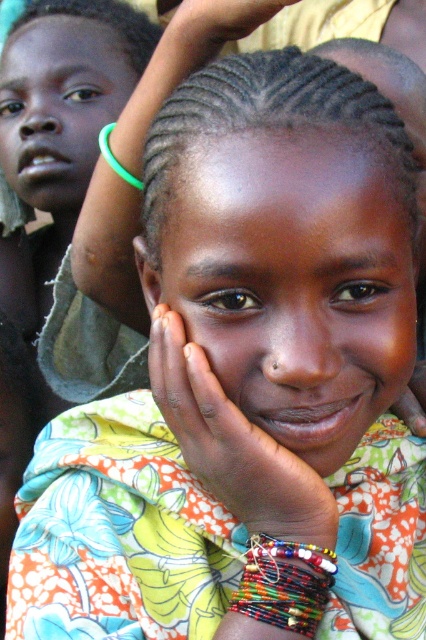
Question: Can you confirm if matte floral dress at center is bigger than green rubber bracelet at center?

Choices:
 (A) yes
 (B) no

Answer: (A)

Question: Which of these objects is positioned farthest from the matte floral dress at center?

Choices:
 (A) matte skin face at upper left
 (B) green rubber bracelet at center

Answer: (A)

Question: Which of the following is the closest to the observer?

Choices:
 (A) beaded multicolored bracelet at lower center
 (B) matte skin face at upper left

Answer: (A)

Question: Which of the following is the closest to the observer?

Choices:
 (A) green rubber bracelet at center
 (B) matte floral dress at center
 (C) matte skin face at upper left

Answer: (B)

Question: Is matte skin face at upper left below green rubber bracelet at center?

Choices:
 (A) no
 (B) yes

Answer: (A)

Question: Can you confirm if matte skin face at upper left is positioned to the left of green rubber bracelet at center?

Choices:
 (A) no
 (B) yes

Answer: (B)